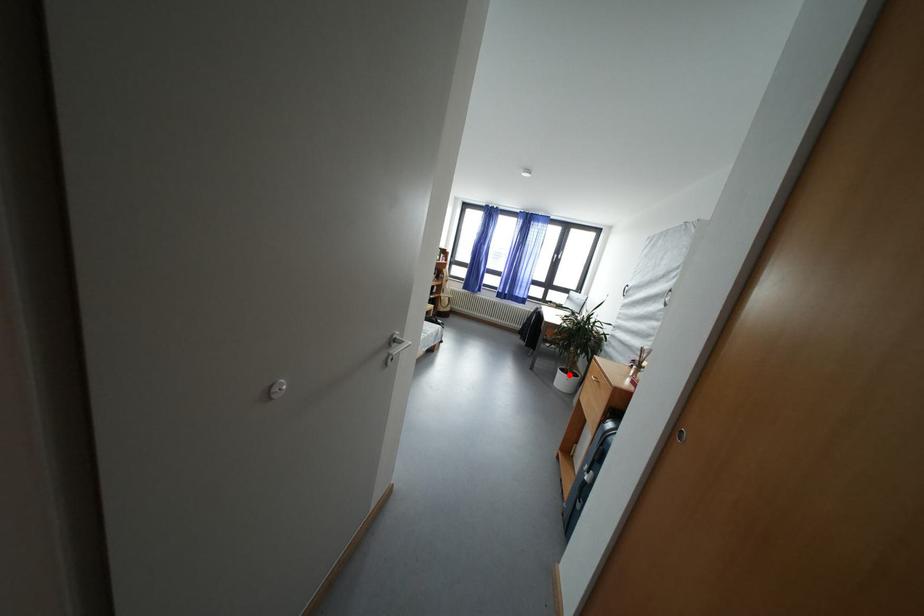
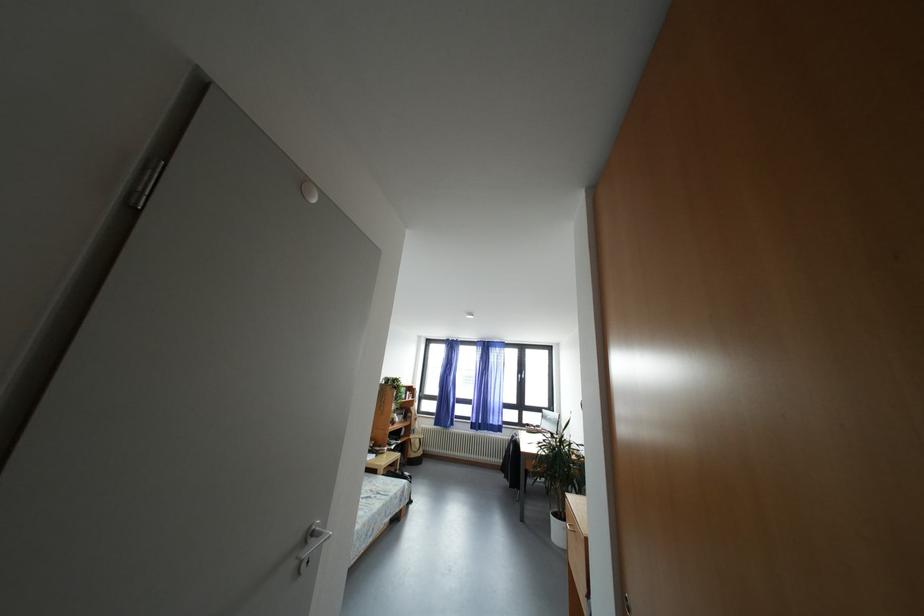
The point at the highlighted location is marked in the first image. Where is the corresponding point in the second image?

(562, 519)